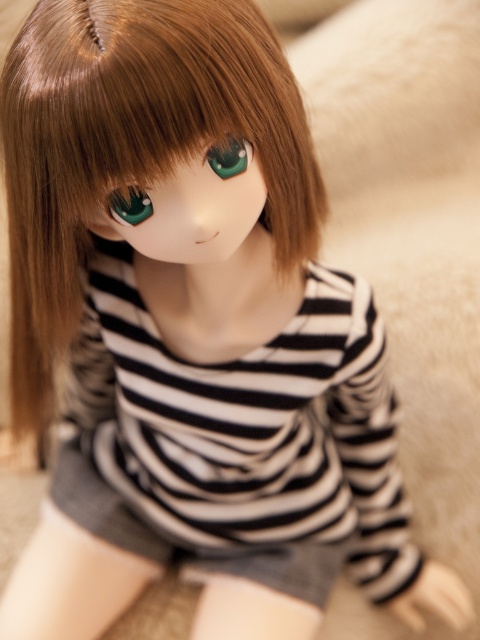
Question: Which point is farther to the camera?

Choices:
 (A) (219, 160)
 (B) (122, 529)

Answer: (B)

Question: Is black striped shirt at center bigger than green glossy eye at center?

Choices:
 (A) no
 (B) yes

Answer: (B)

Question: Based on their relative distances, which object is farther from the green glossy eye at center?

Choices:
 (A) shiny green eye at center
 (B) black striped shirt at center
 (C) shiny brown hair at center

Answer: (B)

Question: Does black striped shirt at center appear on the right side of shiny green eye at center?

Choices:
 (A) yes
 (B) no

Answer: (A)

Question: Does black striped shirt at center lie in front of green glossy eye at center?

Choices:
 (A) yes
 (B) no

Answer: (B)

Question: Among these objects, which one is farthest from the camera?

Choices:
 (A) shiny brown hair at center
 (B) shiny green eye at center
 (C) black striped shirt at center

Answer: (C)